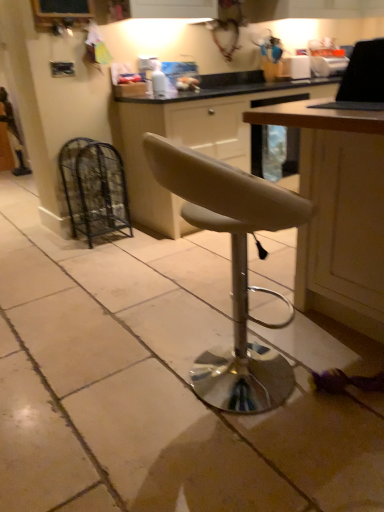
Question: Is wooden table at right shorter than beige leather stool at center?

Choices:
 (A) no
 (B) yes

Answer: (A)

Question: Is wooden table at right facing away from beige leather stool at center?

Choices:
 (A) no
 (B) yes

Answer: (A)

Question: Is beige leather stool at center located within wooden table at right?

Choices:
 (A) yes
 (B) no

Answer: (B)

Question: From a real-world perspective, does wooden table at right stand above beige leather stool at center?

Choices:
 (A) yes
 (B) no

Answer: (A)

Question: Is wooden table at right not inside beige leather stool at center?

Choices:
 (A) yes
 (B) no

Answer: (A)

Question: Is wooden table at right taller than beige leather stool at center?

Choices:
 (A) yes
 (B) no

Answer: (A)

Question: Is black wire mesh cage at left completely or partially outside of wooden table at right?

Choices:
 (A) yes
 (B) no

Answer: (A)

Question: Considering the relative sizes of black wire mesh cage at left and wooden table at right in the image provided, is black wire mesh cage at left taller than wooden table at right?

Choices:
 (A) no
 (B) yes

Answer: (A)

Question: Is black wire mesh cage at left shorter than wooden table at right?

Choices:
 (A) yes
 (B) no

Answer: (A)

Question: Does black wire mesh cage at left come in front of wooden table at right?

Choices:
 (A) yes
 (B) no

Answer: (B)

Question: Is black wire mesh cage at left to the right of wooden table at right from the viewer's perspective?

Choices:
 (A) no
 (B) yes

Answer: (A)

Question: Is black wire mesh cage at left positioned with its back to wooden table at right?

Choices:
 (A) yes
 (B) no

Answer: (B)

Question: Can you confirm if black glossy laptop at upper right is shorter than wooden table at right?

Choices:
 (A) yes
 (B) no

Answer: (A)